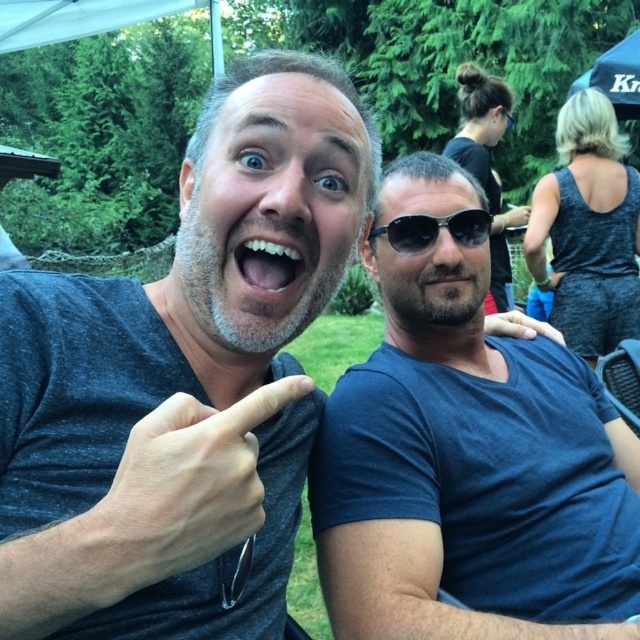
Is gray matte t-shirt at center smaller than gray fabric tank top at upper right?

Yes, gray matte t-shirt at center is smaller than gray fabric tank top at upper right.

Does gray matte t-shirt at center have a lesser width compared to gray fabric tank top at upper right?

Indeed, gray matte t-shirt at center has a lesser width compared to gray fabric tank top at upper right.

At what (x,y) coordinates should I click in order to perform the action: click on gray matte t-shirt at center. Please return your answer as a coordinate pair (x, y). Looking at the image, I should click on (189, 376).

Who is positioned more to the left, black plastic sunglasses at center or blue fabric at right?

Positioned to the left is black plastic sunglasses at center.

Where is `black plastic sunglasses at center`? The width and height of the screenshot is (640, 640). black plastic sunglasses at center is located at coordinates click(435, 228).

At what (x,y) coordinates should I click in order to perform the action: click on black plastic sunglasses at center. Please return your answer as a coordinate pair (x, y). The width and height of the screenshot is (640, 640). Looking at the image, I should click on (435, 228).

Does point (120, 584) come closer to viewer compared to point (557, 332)?

Yes.

Does matte gray finger at center appear on the left side of blue fabric at right?

Indeed, matte gray finger at center is positioned on the left side of blue fabric at right.

Does point (205, 448) come in front of point (538, 323)?

Yes.

This screenshot has width=640, height=640. Identify the location of matte gray finger at center. (184, 486).